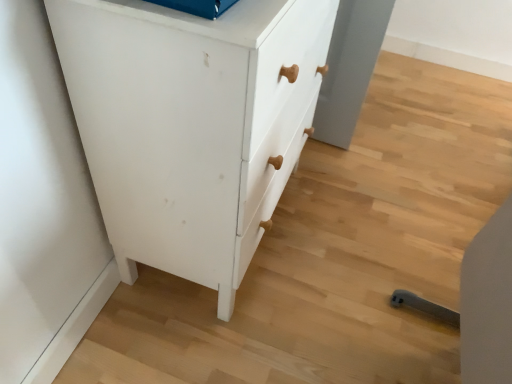
Locate an element on the screen. The width and height of the screenshot is (512, 384). free location in front of white matte cabinet at center is located at coordinates (228, 334).